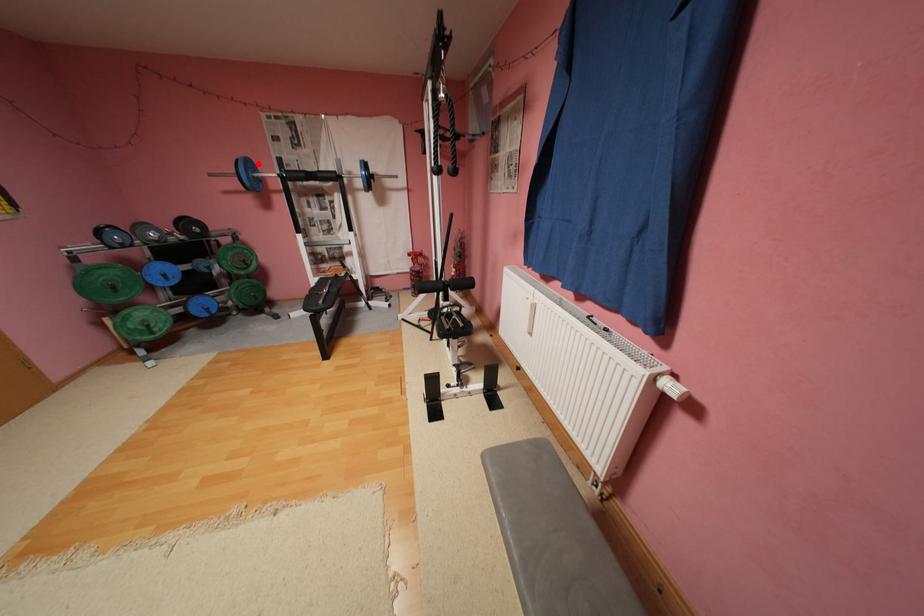
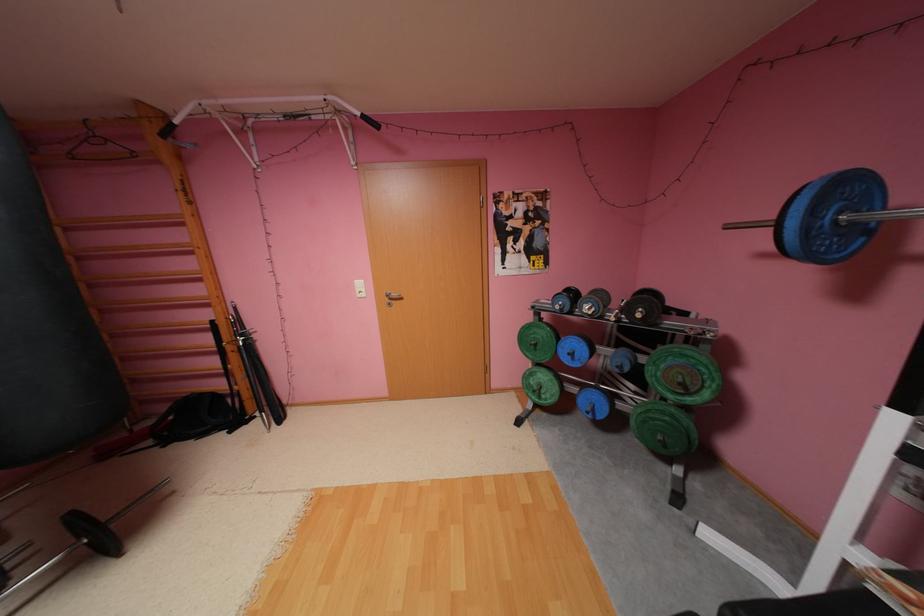
Locate, in the second image, the point that corresponds to the highlighted location in the first image.

(855, 188)